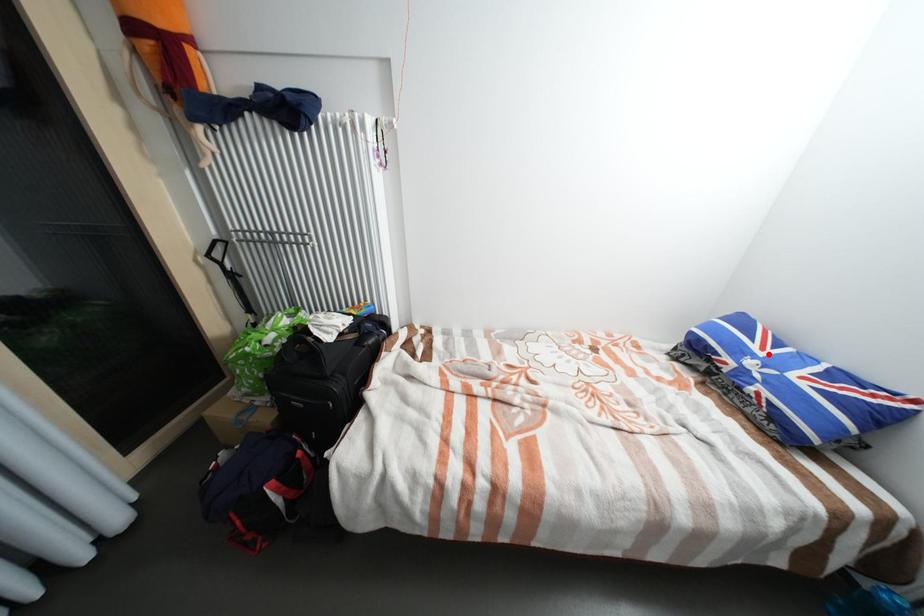
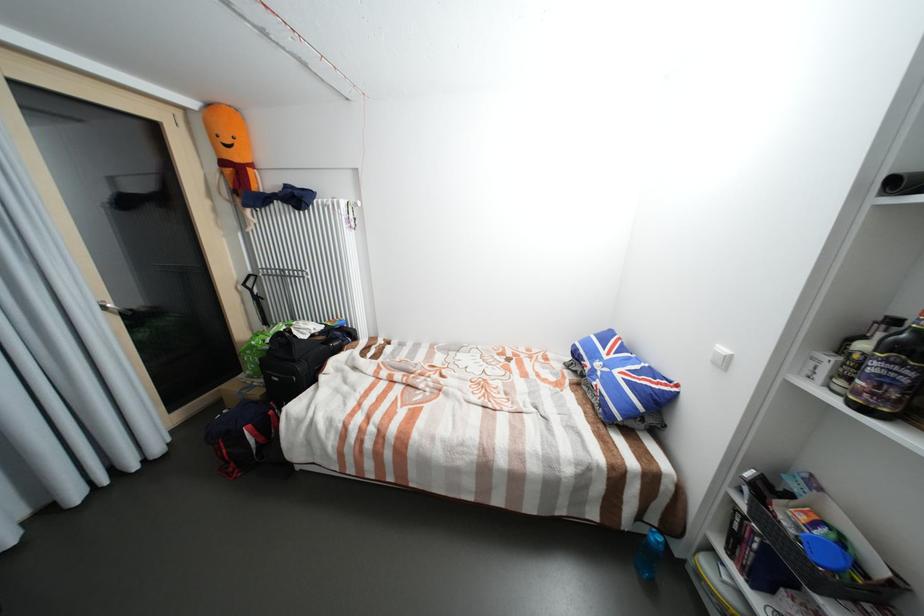
The point at the highlighted location is marked in the first image. Where is the corresponding point in the second image?

(613, 358)